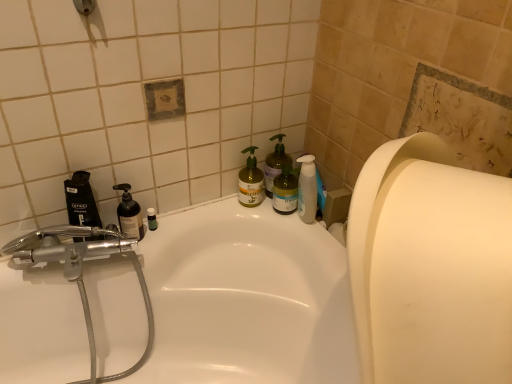
Question: Considering the relative sizes of green matte bottle at center, the second cleaning product viewed from the right, and green matte pump bottle at upper right, positioned as the third cleaning product in left-to-right order, in the image provided, is green matte bottle at center, the second cleaning product viewed from the right, bigger than green matte pump bottle at upper right, positioned as the third cleaning product in left-to-right order,?

Choices:
 (A) yes
 (B) no

Answer: (B)

Question: Does green matte bottle at center, the 2th cleaning product positioned from the left, appear on the left side of green matte pump bottle at upper right, positioned as the third cleaning product in left-to-right order?

Choices:
 (A) no
 (B) yes

Answer: (B)

Question: Are green matte bottle at center, the second cleaning product viewed from the right, and green matte pump bottle at upper right, positioned as the third cleaning product in left-to-right order, beside each other?

Choices:
 (A) no
 (B) yes

Answer: (B)

Question: Could you tell me if green matte bottle at center, the second cleaning product viewed from the right, is facing green matte pump bottle at upper right, positioned as the third cleaning product in left-to-right order?

Choices:
 (A) no
 (B) yes

Answer: (A)

Question: Is green matte bottle at center, the second cleaning product viewed from the right, positioned far away from green matte pump bottle at upper right, positioned as the third cleaning product in left-to-right order?

Choices:
 (A) yes
 (B) no

Answer: (B)

Question: Visually, is white matte paper towel at right positioned to the left or to the right of transparent plastic bottle at left?

Choices:
 (A) left
 (B) right

Answer: (B)

Question: Looking at the image, does white matte paper towel at right seem bigger or smaller compared to transparent plastic bottle at left?

Choices:
 (A) big
 (B) small

Answer: (A)

Question: Is white matte paper towel at right inside the boundaries of transparent plastic bottle at left, or outside?

Choices:
 (A) inside
 (B) outside

Answer: (B)

Question: From a real-world perspective, relative to transparent plastic bottle at left, is white matte paper towel at right vertically above or below?

Choices:
 (A) below
 (B) above

Answer: (B)

Question: Would you say matte silver showerhead at upper left is inside or outside chrome metallic faucet at left?

Choices:
 (A) outside
 (B) inside

Answer: (A)

Question: Looking at the image, does matte silver showerhead at upper left seem bigger or smaller compared to chrome metallic faucet at left?

Choices:
 (A) big
 (B) small

Answer: (B)

Question: From the image's perspective, is matte silver showerhead at upper left positioned above or below chrome metallic faucet at left?

Choices:
 (A) above
 (B) below

Answer: (A)

Question: From a real-world perspective, relative to chrome metallic faucet at left, is matte silver showerhead at upper left vertically above or below?

Choices:
 (A) above
 (B) below

Answer: (A)

Question: Is chrome metallic faucet at left in front of or behind white glossy bathtub at center in the image?

Choices:
 (A) front
 (B) behind

Answer: (B)

Question: Based on their sizes in the image, would you say chrome metallic faucet at left is bigger or smaller than white glossy bathtub at center?

Choices:
 (A) big
 (B) small

Answer: (B)